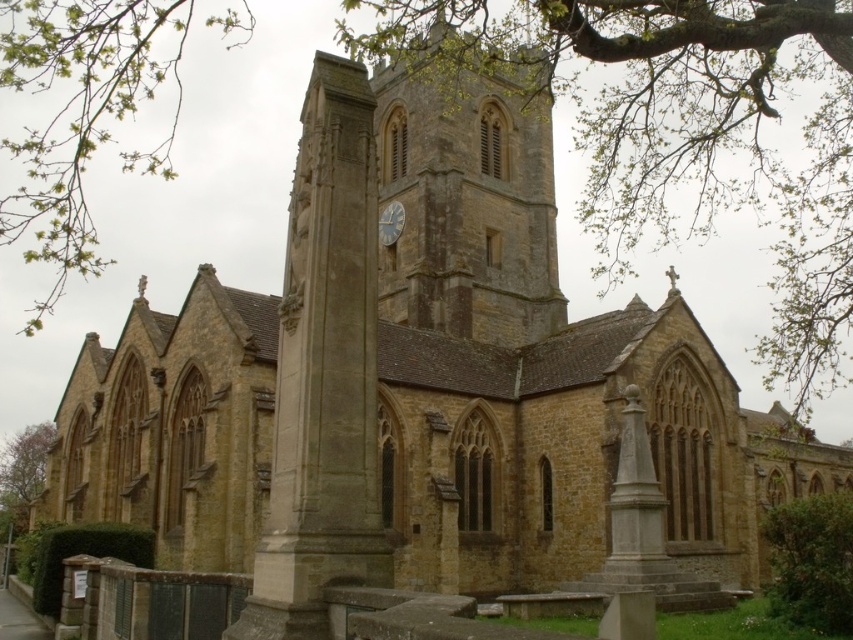
You are a drone operator planning to fly a drone from the green leafy branches at upper center to the green leafy bush at lower right. Given that the drone has a maximum flight range of 50 meters, can it successfully complete the journey?

The distance between the green leafy branches at upper center and the green leafy bush at lower right is 60.76 meters. Since the drone can only fly up to 50 meters, it cannot complete the journey without recharging or refueling.

You are a photographer planning to capture the historic stone church with its surroundings. You notice the green leafy branches at upper center and the green leafy tree at lower left in your frame. Which of these two objects appears bigger in the image?

The green leafy branches at upper center appears bigger than the green leafy tree at lower left in the image.

Based on the photo, you are standing in front of the historic stone church and want to take a photo of the brown stone clock tower at center and the green leafy branches at upper left. Which object should you focus on first to ensure it appears clearer in your photo?

The brown stone clock tower at center is further to the viewer than the green leafy branches at upper left, so you should focus on the brown stone clock tower at center first to ensure it appears clearer in your photo.